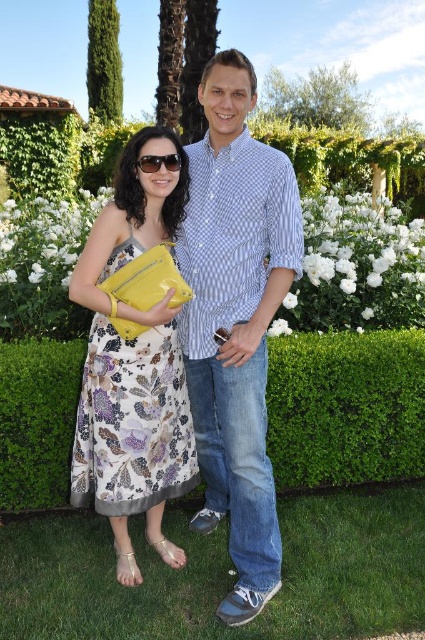
You are a photographer setting up a shot in the garden. You want to ensure that both the green grass at lower center and the green leafy hedge at center are visible in the frame. Which object should you focus on to keep both in focus?

To ensure both the green grass at lower center and the green leafy hedge at center are in focus, focus on the green leafy hedge at center since it is further away from the camera than the green grass at lower center, allowing the green grass at lower center to be within the depth of field.

You are a gardener who needs to mow the lawn. You see the green grass at lower center and the green leafy hedge at center. Which one is shorter and requires mowing?

The green grass at lower center is shorter than the green leafy hedge at center, so the green grass at lower center does not require mowing. The hedge is taller and may need trimming instead.